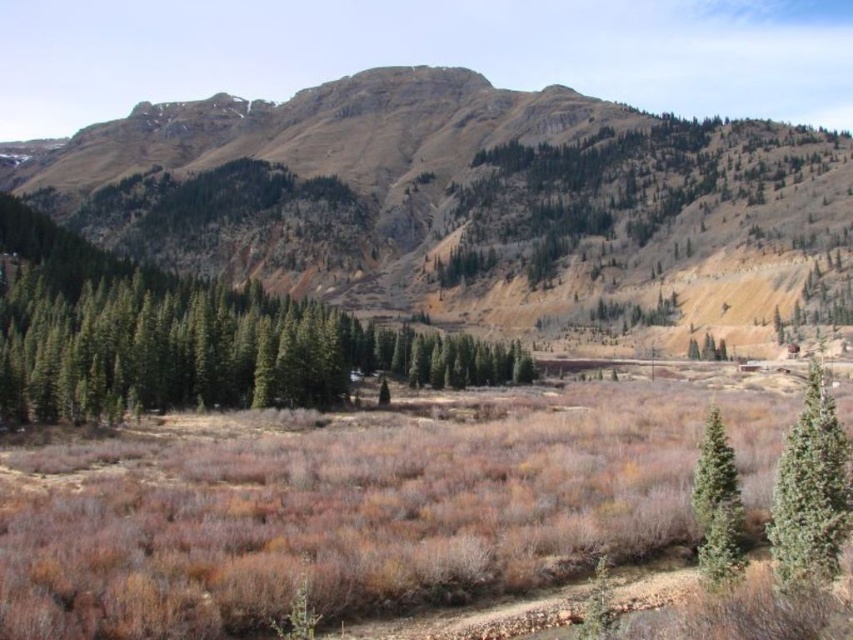
Question: Among these objects, which one is nearest to the camera?

Choices:
 (A) brown dry grass at center
 (B) green matte tree at left

Answer: (A)

Question: Estimate the real-world distances between objects in this image. Which object is farther from the green matte tree at left?

Choices:
 (A) brown dry grass at center
 (B) green textured evergreen at lower right

Answer: (B)

Question: Estimate the real-world distances between objects in this image. Which object is farther from the green matte tree at lower right?

Choices:
 (A) green matte tree at left
 (B) green textured evergreen at lower right
 (C) brown dry grass at center
 (D) brown rocky mountain at center

Answer: (D)

Question: Does brown rocky mountain at center have a larger size compared to green matte tree at left?

Choices:
 (A) yes
 (B) no

Answer: (A)

Question: Does brown dry grass at center appear under green textured evergreen at lower right?

Choices:
 (A) no
 (B) yes

Answer: (B)

Question: Does green matte tree at left lie in front of green matte tree at lower right?

Choices:
 (A) no
 (B) yes

Answer: (A)